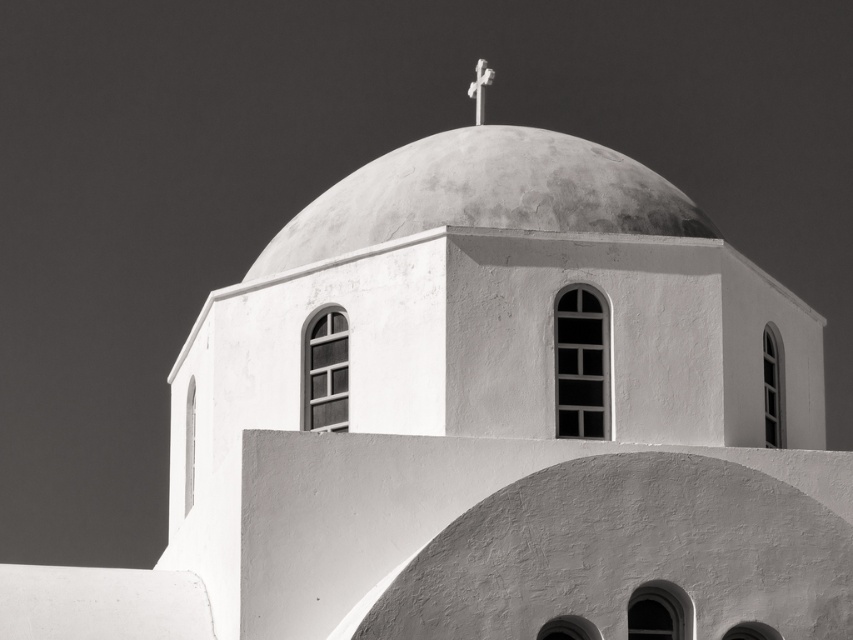
You are an architect analyzing the structural integrity of the building. Based on the image, where is the smooth concrete dome at center located in terms of coordinates?

The smooth concrete dome at center is located at coordinates point (x=485, y=195).

You are a maintenance worker needing to inspect the white wooden cross at top center. You have a ladder that is 40 feet long. The smooth concrete dome at center is in your way. Can you safely reach the cross without climbing onto the dome?

The distance between the smooth concrete dome at center and the white wooden cross at top center is 43.60 feet. Since the ladder is only 40 feet long, it is not long enough to reach the cross from the ground. Therefore, you cannot safely reach the cross without climbing onto the dome.

You are standing at the point marked as point (x=440, y=208). You want to take a photo of the church dome. Is the dome visible from your current position?

The point (x=440, y=208) is 64.04 meters away from the viewer. Since the dome is at the top of the church, it should be visible from that distance unless there are obstructions. The scene description mentions no obstructions, so yes, the dome is visible.